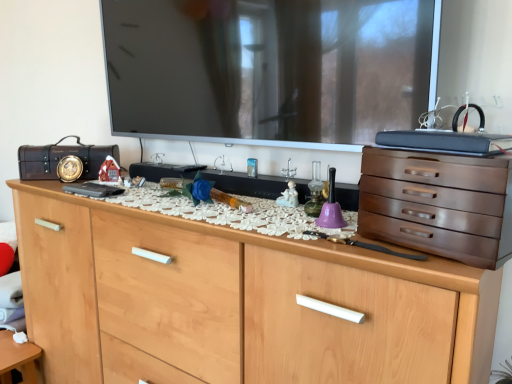
Question: Is satin brown chest of drawers at right, which is counted as the first chest of drawers, starting from the top, smaller than white matte table at lower left?

Choices:
 (A) no
 (B) yes

Answer: (B)

Question: Does satin brown chest of drawers at right, which is counted as the 2th chest of drawers, starting from the bottom, appear on the left side of white matte table at lower left?

Choices:
 (A) no
 (B) yes

Answer: (A)

Question: Is satin brown chest of drawers at right, which is counted as the 2th chest of drawers, starting from the bottom, further to the viewer compared to white matte table at lower left?

Choices:
 (A) no
 (B) yes

Answer: (A)

Question: Is satin brown chest of drawers at right, which is counted as the 2th chest of drawers, starting from the bottom, taller than white matte table at lower left?

Choices:
 (A) yes
 (B) no

Answer: (B)

Question: Is satin brown chest of drawers at right, which is counted as the 2th chest of drawers, starting from the bottom, wider than white matte table at lower left?

Choices:
 (A) no
 (B) yes

Answer: (B)

Question: From a real-world perspective, is satin brown chest of drawers at right, which is counted as the first chest of drawers, starting from the top, below white matte table at lower left?

Choices:
 (A) no
 (B) yes

Answer: (A)

Question: Is white porcelain figurine at center inside light wood chest of drawers at center, the first chest of drawers from the bottom?

Choices:
 (A) no
 (B) yes

Answer: (A)

Question: Can you confirm if light wood chest of drawers at center, which is counted as the second chest of drawers, starting from the top, is shorter than white porcelain figurine at center?

Choices:
 (A) no
 (B) yes

Answer: (A)

Question: Considering the relative positions of light wood chest of drawers at center, the first chest of drawers from the bottom, and white porcelain figurine at center in the image provided, is light wood chest of drawers at center, the first chest of drawers from the bottom, to the right of white porcelain figurine at center from the viewer's perspective?

Choices:
 (A) yes
 (B) no

Answer: (B)

Question: Does light wood chest of drawers at center, the first chest of drawers from the bottom, come behind white porcelain figurine at center?

Choices:
 (A) no
 (B) yes

Answer: (A)

Question: From a real-world perspective, is light wood chest of drawers at center, which is counted as the second chest of drawers, starting from the top, under white porcelain figurine at center?

Choices:
 (A) no
 (B) yes

Answer: (B)

Question: Is light wood chest of drawers at center, the first chest of drawers from the bottom, thinner than white porcelain figurine at center?

Choices:
 (A) no
 (B) yes

Answer: (A)

Question: Considering the relative sizes of matte black suitcase at left and white porcelain figurine at center in the image provided, is matte black suitcase at left smaller than white porcelain figurine at center?

Choices:
 (A) no
 (B) yes

Answer: (A)